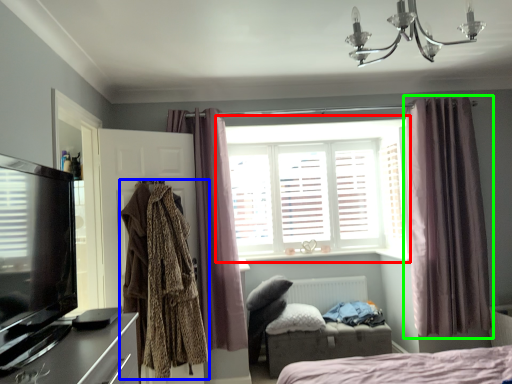
Question: Estimate the real-world distances between objects in this image. Which object is closer to window (highlighted by a red box), clothing (highlighted by a blue box) or curtain (highlighted by a green box)?

Choices:
 (A) clothing
 (B) curtain

Answer: (B)